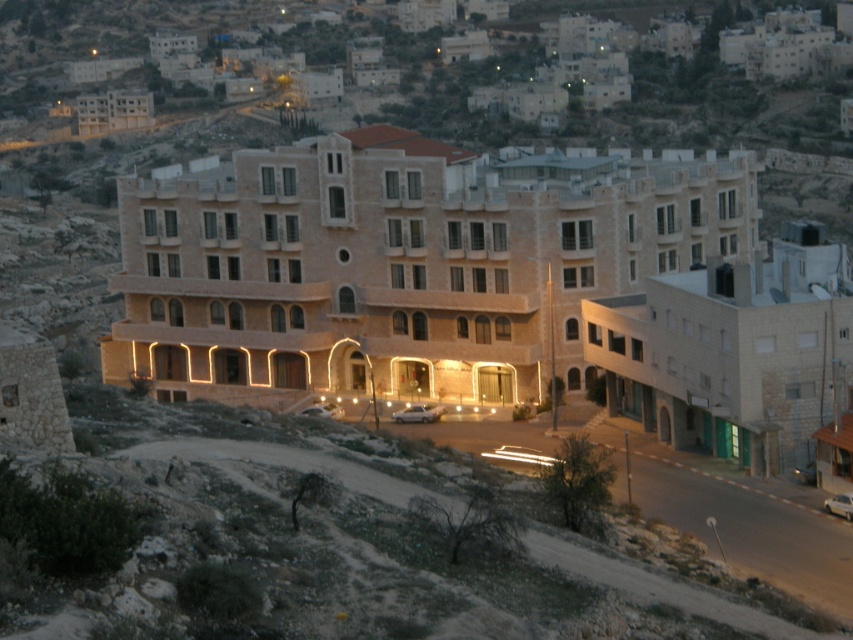
Is beige stone building at upper center above beige stone building at lower right?

Indeed, beige stone building at upper center is positioned over beige stone building at lower right.

This screenshot has width=853, height=640. Find the location of `beige stone building at upper center`. beige stone building at upper center is located at coordinates (445, 68).

Image resolution: width=853 pixels, height=640 pixels. Describe the element at coordinates (445, 68) in the screenshot. I see `beige stone building at upper center` at that location.

This screenshot has width=853, height=640. Identify the location of beige stone building at upper center. (445, 68).

Image resolution: width=853 pixels, height=640 pixels. Describe the element at coordinates (399, 262) in the screenshot. I see `beige stone hotel at center` at that location.

At what (x,y) coordinates should I click in order to perform the action: click on beige stone hotel at center. Please return your answer as a coordinate pair (x, y). This screenshot has width=853, height=640. Looking at the image, I should click on (399, 262).

Between point (196, 300) and point (619, 323), which one is positioned behind?

The point (196, 300) is behind.

Does beige stone hotel at center appear on the right side of beige stone building at lower right?

No, beige stone hotel at center is not to the right of beige stone building at lower right.

Looking at this image, who is more forward, (431,365) or (781,228)?

Point (431,365)

Find the location of a particular element. beige stone hotel at center is located at coordinates (399, 262).